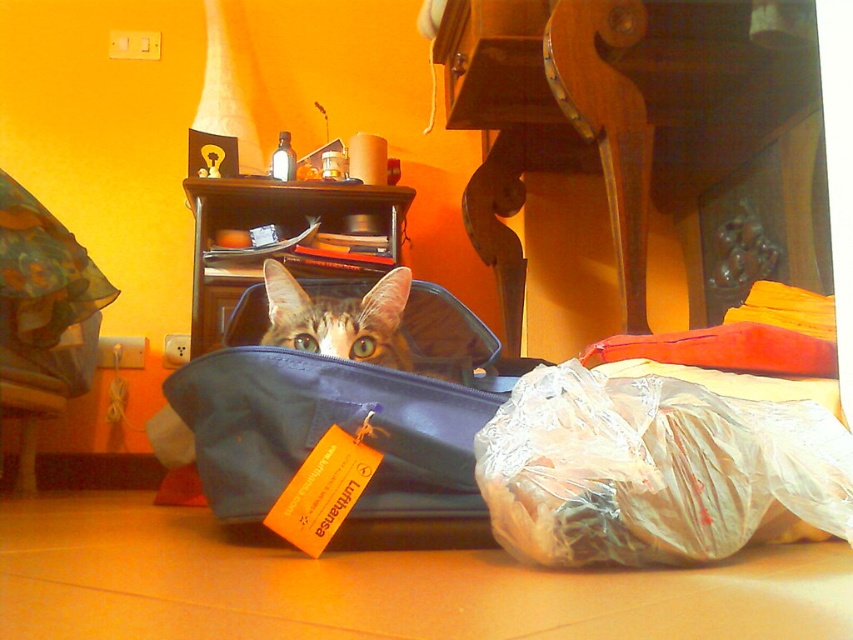
Who is positioned more to the left, transparent plastic bag at center or tabby fur cat at center?

From the viewer's perspective, tabby fur cat at center appears more on the left side.

Which is behind, point (660, 524) or point (341, 324)?

Positioned behind is point (341, 324).

Locate an element on the screen. This screenshot has height=640, width=853. transparent plastic bag at center is located at coordinates (654, 470).

Who is positioned more to the left, blue fabric bag at center or tabby fur cat at center?

tabby fur cat at center is more to the left.

Does point (213, 362) come farther from viewer compared to point (337, 326)?

No, (213, 362) is closer to viewer.

Which is in front, point (467, 465) or point (401, 353)?

Point (467, 465)

Find the location of a particular element. blue fabric bag at center is located at coordinates 338,397.

What do you see at coordinates (654, 470) in the screenshot?
I see `transparent plastic bag at center` at bounding box center [654, 470].

Does transparent plastic bag at center have a greater width compared to blue fabric bag at center?

Incorrect, transparent plastic bag at center's width does not surpass blue fabric bag at center's.

Between point (532, 502) and point (317, 408), which one is positioned in front?

Point (532, 502) is more forward.

The width and height of the screenshot is (853, 640). I want to click on transparent plastic bag at center, so click(654, 470).